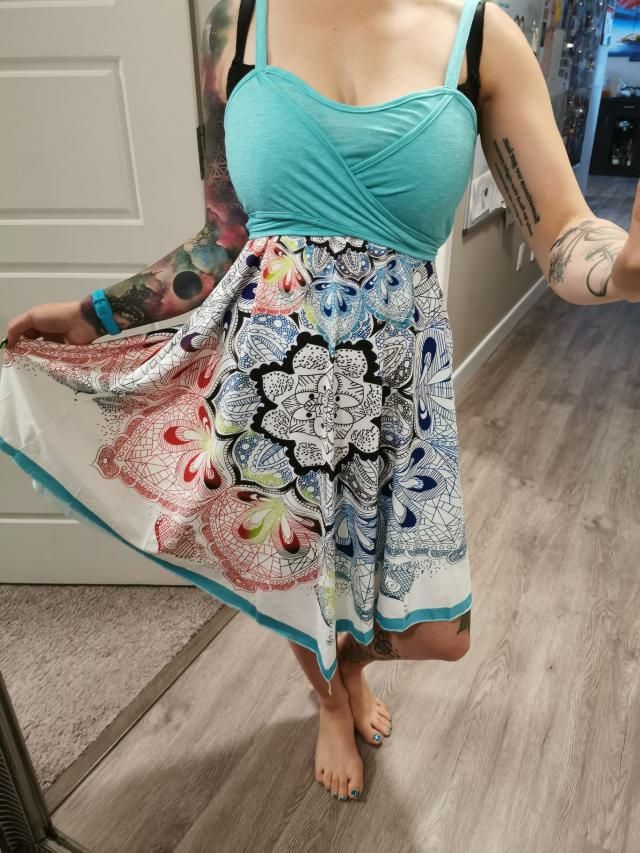
The width and height of the screenshot is (640, 853). Find the location of `white door`. white door is located at coordinates (148, 124).